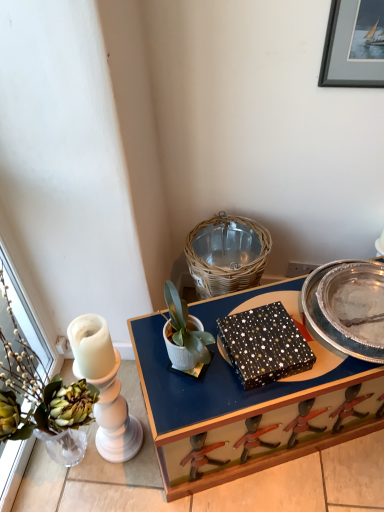
The height and width of the screenshot is (512, 384). Find the location of `free space to the left of black textured box at center`. free space to the left of black textured box at center is located at coordinates (185, 372).